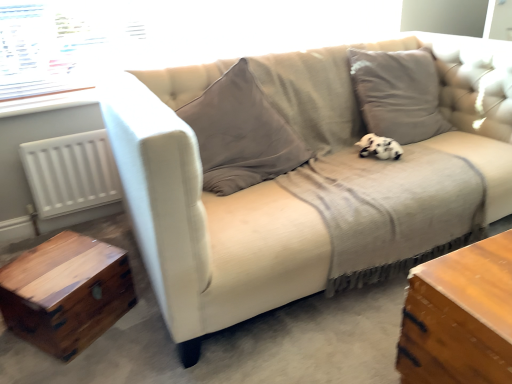
What are the coordinates of `empty space that is ontop of wooden trunk at lower left` in the screenshot? It's located at (55, 268).